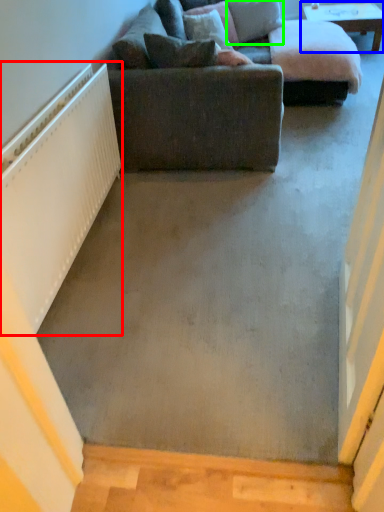
Question: Considering the real-world distances, which object is closest to radiator (highlighted by a red box)? table (highlighted by a blue box) or pillow (highlighted by a green box).

Choices:
 (A) table
 (B) pillow

Answer: (B)